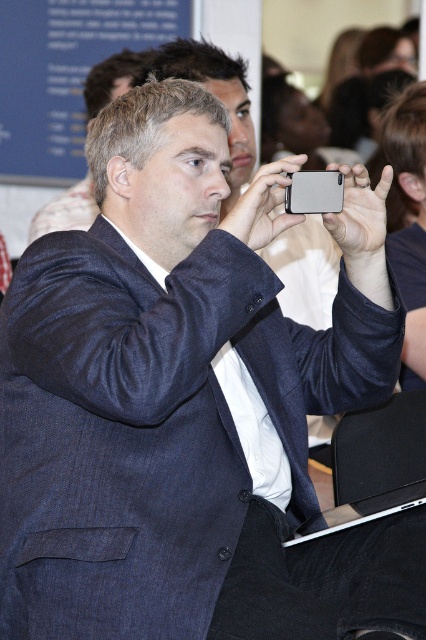
What are the coordinates of the dark blue textured suit at center?

The dark blue textured suit at center is located at point (154, 428).

You are an event organizer and you need to arrange the seating so that the dark blue textured suit at center is positioned to the right of the dark blue suit at center. Is this possible based on the current arrangement?

The dark blue textured suit at center is already positioned to the right of the dark blue suit at center, so the current arrangement meets the requirement.

Looking at this image, you are organizing a formal event and need to ensure that the dark blue textured suit at center and the dark blue suit at center can both fit through the main entrance door, which is 1 meter wide. Based on their sizes, will both suits be able to pass through the door without any issues?

The dark blue textured suit at center is wider than the dark blue suit at center. Since the door is 1 meter wide, both suits can pass through as their widths are within the door width.